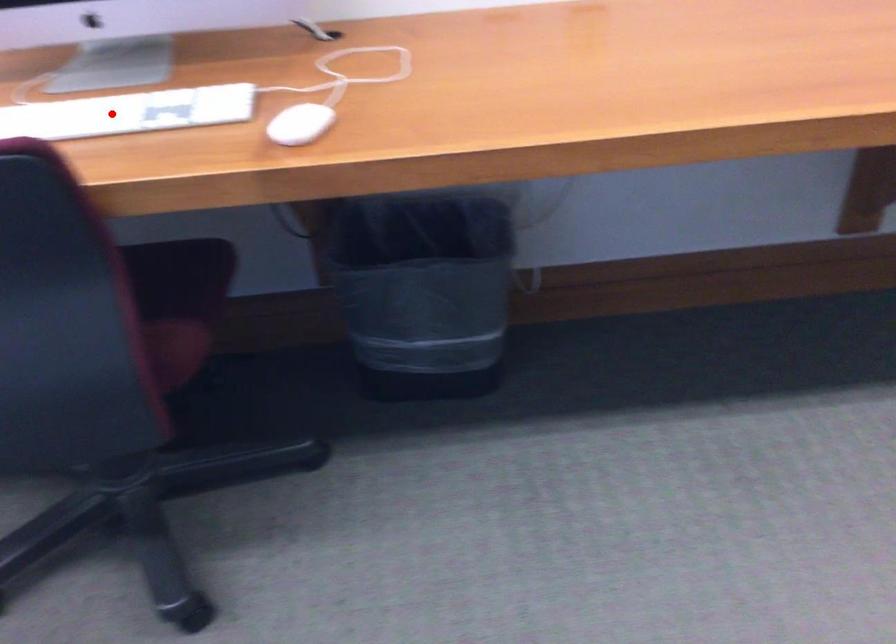
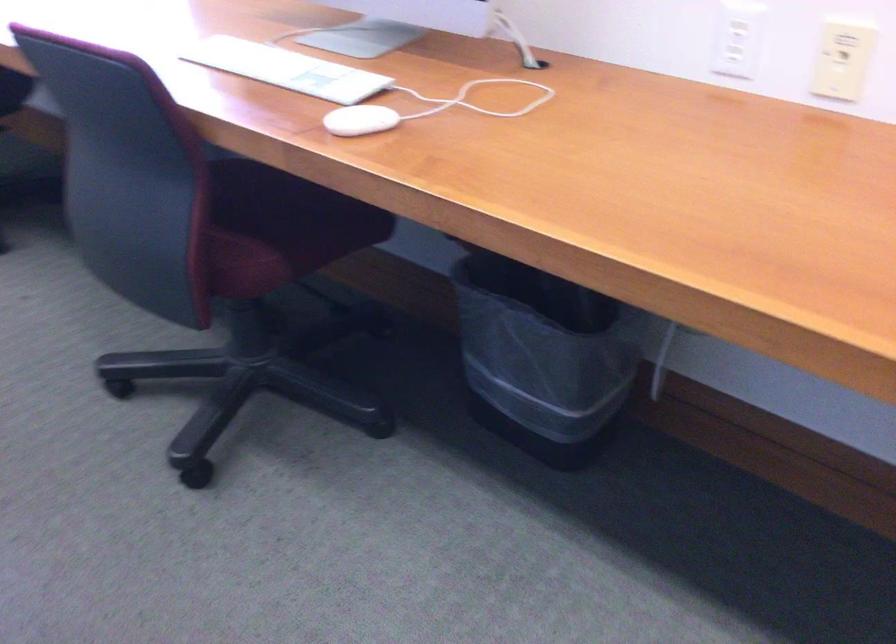
Find the pixel in the second image that matches the highlighted location in the first image.

(286, 69)